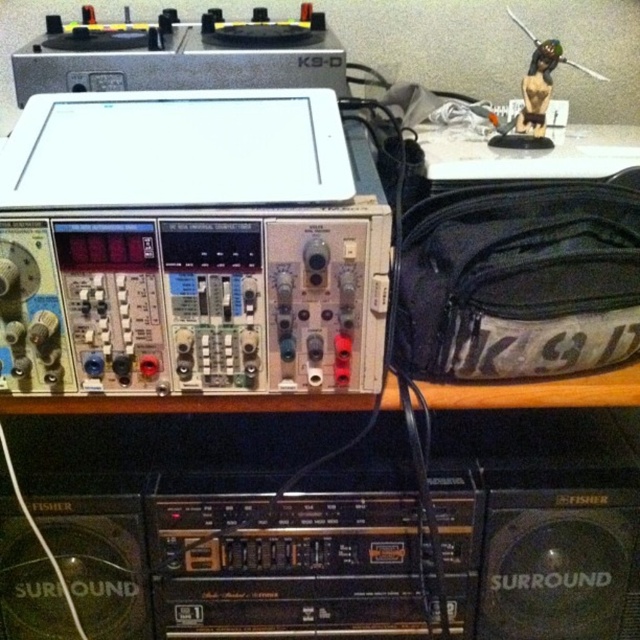
Question: Among these points, which one is nearest to the camera?

Choices:
 (A) (518, 128)
 (B) (634, 588)

Answer: (A)

Question: Among these objects, which one is farthest from the camera?

Choices:
 (A) black plastic speaker at lower right
 (B) black plastic speaker at lower left
 (C) matte black statue at upper right

Answer: (C)

Question: Can you confirm if black plastic speaker at lower left is smaller than matte black statue at upper right?

Choices:
 (A) no
 (B) yes

Answer: (A)

Question: Is black plastic speaker at lower left behind matte black statue at upper right?

Choices:
 (A) no
 (B) yes

Answer: (A)

Question: Considering the relative positions of black plastic speaker at lower right and black plastic speaker at lower left in the image provided, where is black plastic speaker at lower right located with respect to black plastic speaker at lower left?

Choices:
 (A) below
 (B) above

Answer: (A)

Question: Among these points, which one is nearest to the camera?

Choices:
 (A) (522, 77)
 (B) (628, 596)

Answer: (B)